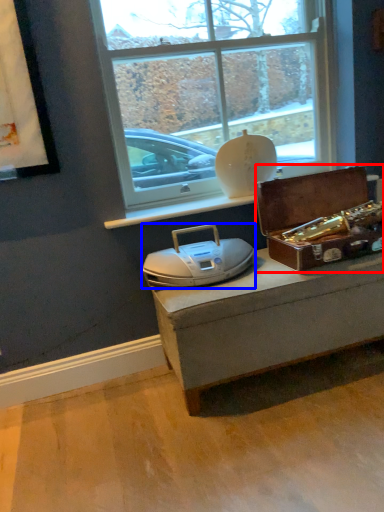
Question: Which point is further to the camera, box (highlighted by a red box) or stereo (highlighted by a blue box)?

Choices:
 (A) box
 (B) stereo

Answer: (A)